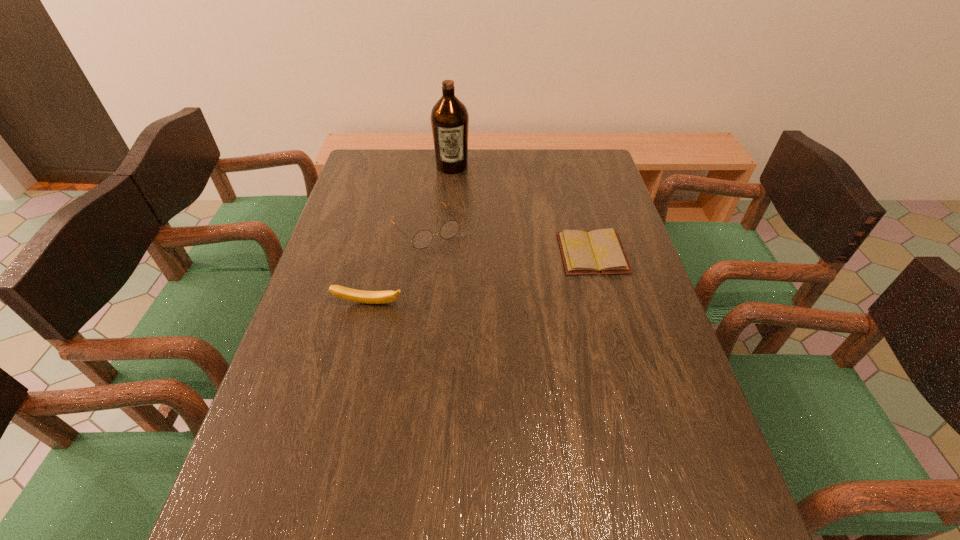
What are the coordinates of `free space on the desktop that is between the nearest object and the shortest object and is positioned on the label of the farthest object` in the screenshot? It's located at (460, 283).

In order to click on free spot on the desktop that is between the banana and the diary and is positioned on the temples of the spectacles in this screenshot , I will do `click(467, 281)`.